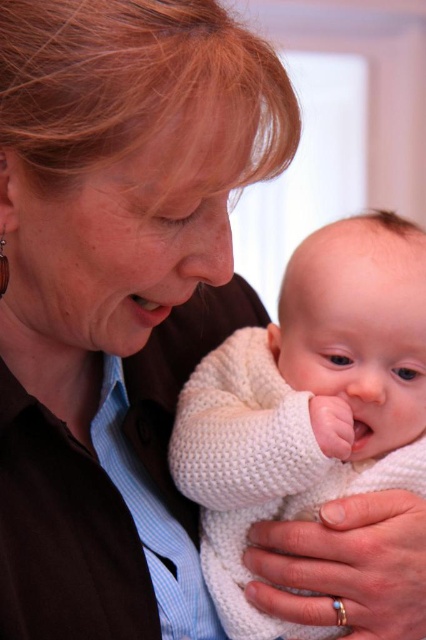
Question: Which object is closer to the camera taking this photo?

Choices:
 (A) white knitted sweater at center
 (B) matte brown sweater at center

Answer: (B)

Question: Can you confirm if matte brown sweater at center is positioned above white knitted sweater at center?

Choices:
 (A) yes
 (B) no

Answer: (A)

Question: Which point is closer to the camera taking this photo?

Choices:
 (A) (294, 483)
 (B) (57, 134)

Answer: (B)

Question: Considering the relative positions of matte brown sweater at center and white knitted sweater at center in the image provided, where is matte brown sweater at center located with respect to white knitted sweater at center?

Choices:
 (A) above
 (B) below

Answer: (A)

Question: Does matte brown sweater at center have a larger size compared to white knitted sweater at center?

Choices:
 (A) yes
 (B) no

Answer: (A)